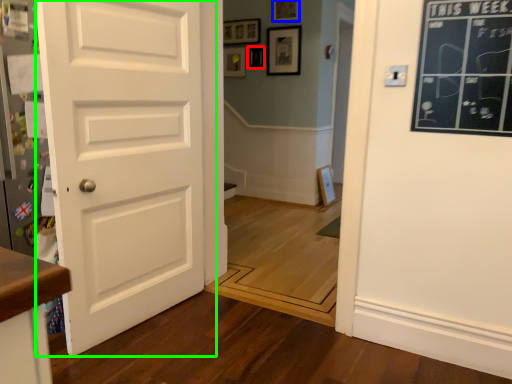
Question: Which object is the farthest from picture frame (highlighted by a red box)? Choose among these: picture frame (highlighted by a blue box) or door (highlighted by a green box).

Choices:
 (A) picture frame
 (B) door

Answer: (B)